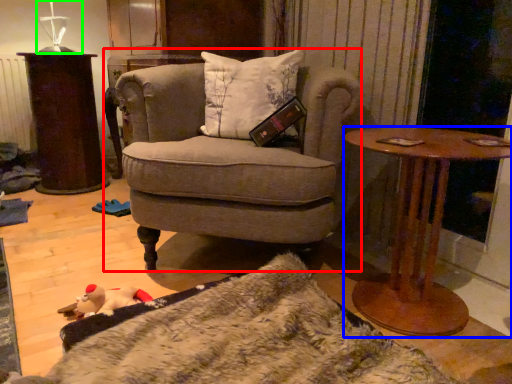
Question: Based on their relative distances, which object is farther from chair (highlighted by a red box)? Choose from desk (highlighted by a blue box) and table lamp (highlighted by a green box).

Choices:
 (A) desk
 (B) table lamp

Answer: (B)